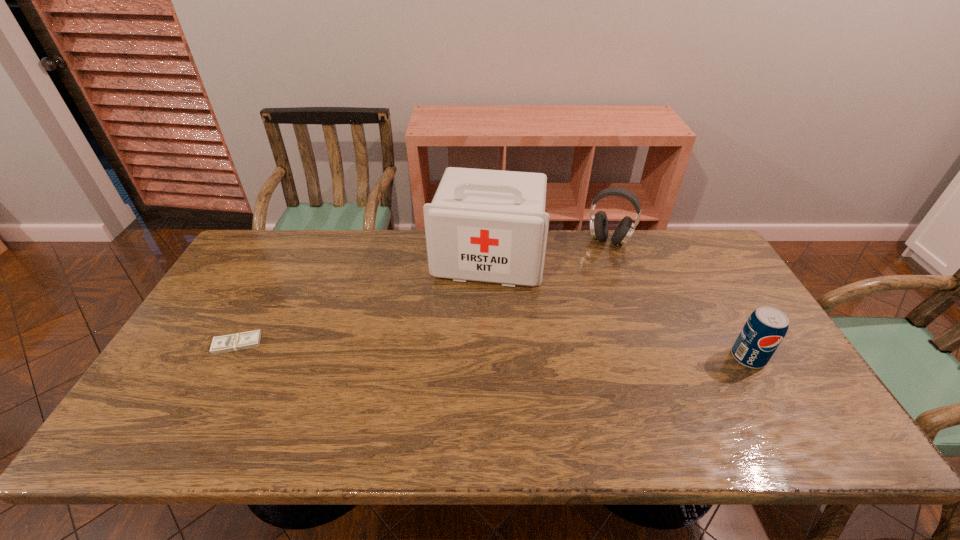
Where is `money`? money is located at coordinates (239, 341).

Identify the location of the leftmost object. (239, 341).

You are a GUI agent. You are given a task and a screenshot of the screen. Output one action in this format:
    pyautogui.click(x=<x>, y=<y>)
    Task: Click on the rightmost object
    
    Given the screenshot: What is the action you would take?
    pyautogui.click(x=766, y=327)

The width and height of the screenshot is (960, 540). Find the location of `pop`. pop is located at coordinates (766, 327).

The image size is (960, 540). Identify the location of the tallest object. (483, 225).

I want to click on the second object from left to right, so click(x=483, y=225).

The width and height of the screenshot is (960, 540). Identify the location of the second object from right to left. (599, 228).

At what (x,y) coordinates should I click in order to perform the action: click on headset. Please return your answer as a coordinate pair (x, y). The width and height of the screenshot is (960, 540). Looking at the image, I should click on (599, 228).

Find the location of a particular element. vacant space located 0.050m on the right of the leftmost object is located at coordinates click(x=279, y=344).

Where is `vacant space located on the left of the rightmost object`? The height and width of the screenshot is (540, 960). vacant space located on the left of the rightmost object is located at coordinates (636, 357).